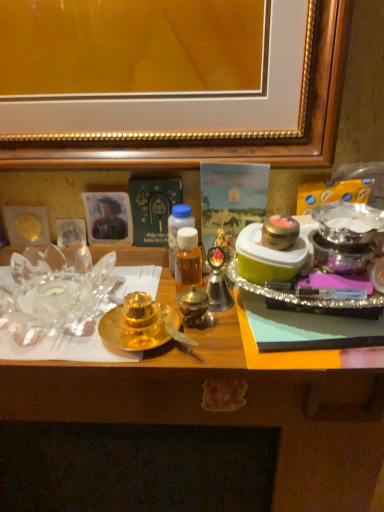
Question: Should I look upward or downward to see gold metallic tray at center?

Choices:
 (A) up
 (B) down

Answer: (B)